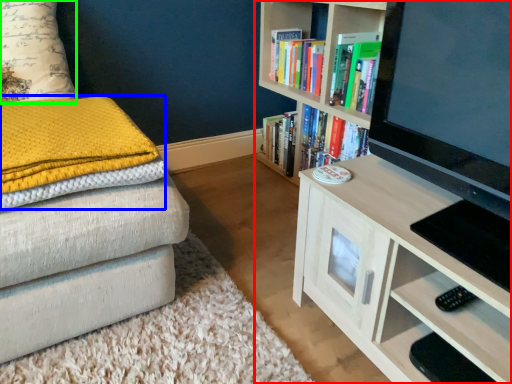
Question: Which object is positioned closest to bookcase (highlighted by a red box)? Select from blanket (highlighted by a blue box) and pillow (highlighted by a green box).

Choices:
 (A) blanket
 (B) pillow

Answer: (A)